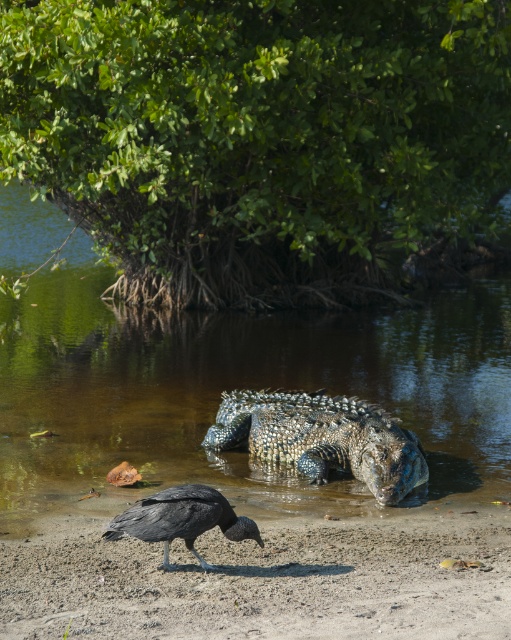
You are a hiker who wants to cross the area where the clear water at center and the black matte bird at lower left are located. The path between them is 3.69 meters wide. If your backpack is 1.5 meters wide, can you safely pass through without getting your backpack stuck?

The path between the clear water at center and the black matte bird at lower left is 3.69 meters wide. Since your backpack is only 1.5 meters wide, you can safely pass through without any issues.

You are a wildlife photographer aiming to capture a photo of both the shiny scaly crocodile at center and the shiny black bird at lower center. Based on their positions, which one would appear closer to the camera in your photo?

The shiny black bird at lower center would appear closer to the camera because it is positioned below the shiny scaly crocodile at center, which is above it.

You are a hiker who wants to cross the shallow water to reach the other side. The shiny black bird at lower center is standing on the sand. Can you safely walk from the bird to the clear water at center without getting your feet wet?

Yes, you can safely walk from the shiny black bird at lower center to the clear water at center because the clear water at center is to the right of the shiny black bird at lower center, so you can step onto the dry sand next to the bird and move towards the water edge without immediately entering the water.